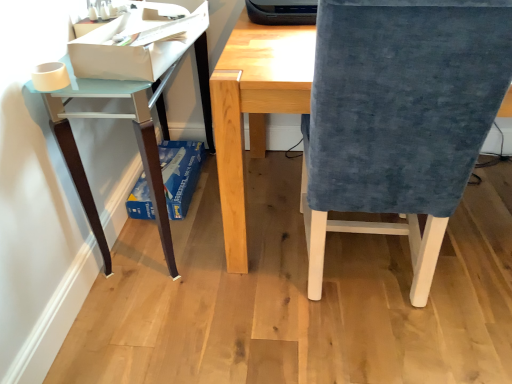
Identify the location of spots to the right of blue cardboard box at lower left, the 1th paperback book from the bottom. (259, 188).